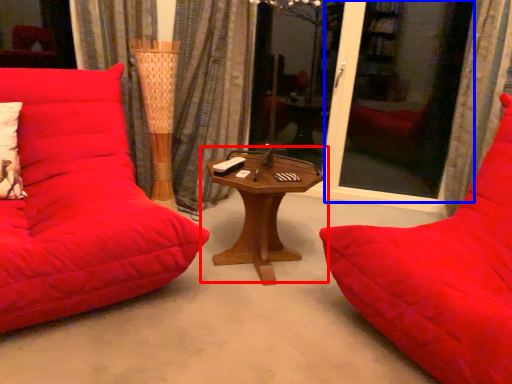
Question: Which object appears farthest to the camera in this image, table (highlighted by a red box) or screen door (highlighted by a blue box)?

Choices:
 (A) table
 (B) screen door

Answer: (B)